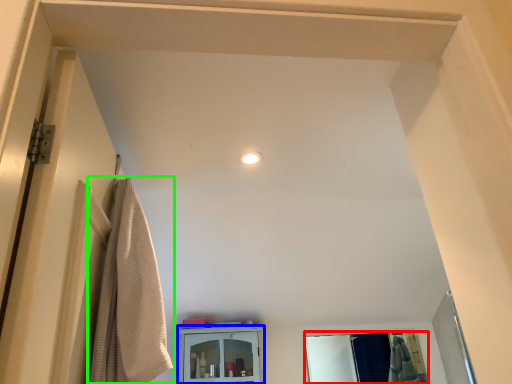
Question: Considering the real-world distances, which object is farthest from mirror (highlighted by a red box)? cabinetry (highlighted by a blue box) or curtain (highlighted by a green box)?

Choices:
 (A) cabinetry
 (B) curtain

Answer: (B)